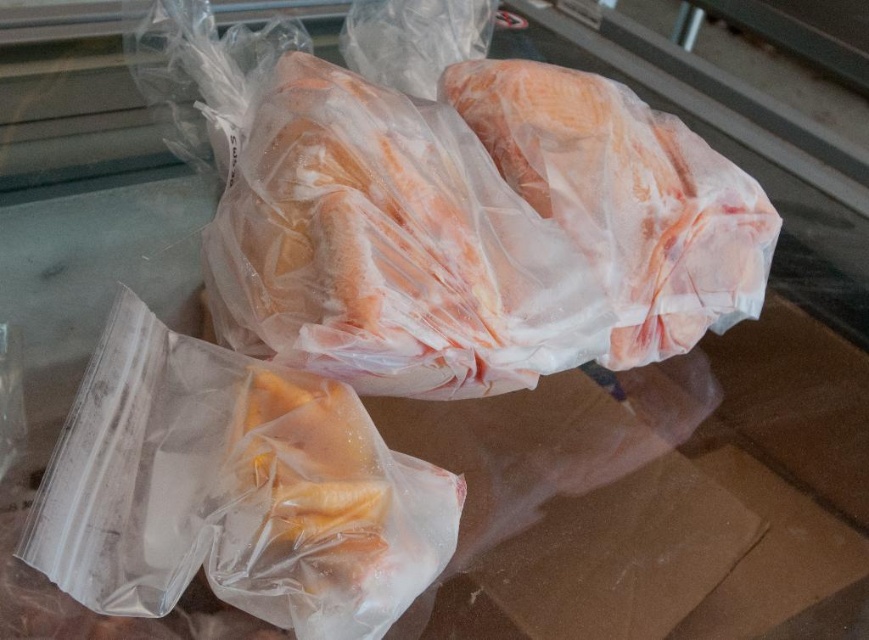
Question: Is translucent plastic bag at lower left positioned at the back of translucent plastic chicken at center?

Choices:
 (A) yes
 (B) no

Answer: (B)

Question: Is translucent plastic bag at lower left smaller than translucent plastic chicken at center?

Choices:
 (A) yes
 (B) no

Answer: (B)

Question: Among these points, which one is farthest from the camera?

Choices:
 (A) (62, 579)
 (B) (668, 212)

Answer: (B)

Question: Observing the image, what is the correct spatial positioning of translucent plastic bag at lower left in reference to translucent plastic chicken at center?

Choices:
 (A) below
 (B) above

Answer: (A)

Question: Which object appears farthest from the camera in this image?

Choices:
 (A) translucent plastic chicken at center
 (B) translucent plastic bag at lower left

Answer: (A)